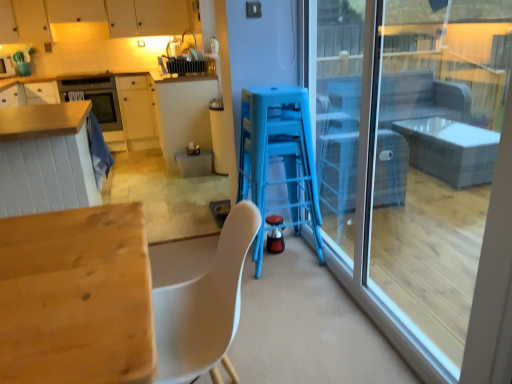
You are a GUI agent. You are given a task and a screenshot of the screen. Output one action in this format:
    pyautogui.click(x=<x>, y=<y>)
    Task: Click on the blue plastic bar stool at center
    The image size is (512, 384).
    Given the screenshot: What is the action you would take?
    pyautogui.click(x=278, y=156)

Image resolution: width=512 pixels, height=384 pixels. Find the location of `matte white cabinets at upper left, which appears as the first cabinetry when viewed from the top`. matte white cabinets at upper left, which appears as the first cabinetry when viewed from the top is located at coordinates (94, 17).

What is the approximate width of shiny black kettle at center, the first appliance when ordered from front to back?

4.61 inches.

This screenshot has width=512, height=384. Identify the location of matte wood cabinetry at left, which is the second cabinetry in top-to-bottom order. (140, 112).

Locate an element on the screen. The image size is (512, 384). blue plastic bar stool at center is located at coordinates (278, 156).

Looking at this image, would you say translucent plastic trash bin at center, the first table in the back-to-front sequence, is a long distance from matte wood cabinetry at left, which is the second cabinetry in top-to-bottom order?

Yes.

Between translucent plastic trash bin at center, which is the 1th table from top to bottom, and matte wood cabinetry at left, which is the second cabinetry in top-to-bottom order, which one has less height?

translucent plastic trash bin at center, which is the 1th table from top to bottom.

Is translucent plastic trash bin at center, the first table in the back-to-front sequence, bigger or smaller than matte wood cabinetry at left, the 1th cabinetry from the bottom?

In the image, translucent plastic trash bin at center, the first table in the back-to-front sequence, appears to be larger than matte wood cabinetry at left, the 1th cabinetry from the bottom.

You are a GUI agent. You are given a task and a screenshot of the screen. Output one action in this format:
    pyautogui.click(x=<x>, y=<y>)
    Task: Click on the table on the right of translucent plastic trash bin at center, acting as the 2th table starting from the bottom
    This screenshot has width=512, height=384.
    Given the screenshot: What is the action you would take?
    pyautogui.click(x=76, y=297)

Is translucent plastic trash bin at center, acting as the 2th table starting from the bottom, surrounding wooden table at lower left, placed as the second table when sorted from top to bottom?

No, wooden table at lower left, placed as the second table when sorted from top to bottom, is located outside of translucent plastic trash bin at center, acting as the 2th table starting from the bottom.

From the image's perspective, would you say translucent plastic trash bin at center, which is the 1th table from top to bottom, is positioned over wooden table at lower left, placed as the 1th table when sorted from bottom to top?

Yes, from the image's perspective, translucent plastic trash bin at center, which is the 1th table from top to bottom, is above wooden table at lower left, placed as the 1th table when sorted from bottom to top.

Which is in front, translucent plastic trash bin at center, the second table from the front, or wooden table at lower left, the 1th table viewed from the front?

wooden table at lower left, the 1th table viewed from the front, is in front.

Can you see matte black oven at upper left touching shiny black kettle at center, the 2th appliance viewed from the left?

There is a gap between matte black oven at upper left and shiny black kettle at center, the 2th appliance viewed from the left.

Which is more to the right, matte black oven at upper left or shiny black kettle at center, the 1th appliance when ordered from right to left?

Positioned to the right is shiny black kettle at center, the 1th appliance when ordered from right to left.

Which is in front, matte black oven at upper left or shiny black kettle at center, the 1th appliance when ordered from right to left?

shiny black kettle at center, the 1th appliance when ordered from right to left, is closer to the camera.

Which of these two, matte black oven at upper left or shiny black kettle at center, the first appliance when ordered from front to back, is smaller?

shiny black kettle at center, the first appliance when ordered from front to back.

Could you tell me if wooden table at lower left, placed as the second table when sorted from back to front, is turned towards matte white cabinets at upper left, which ranks as the second cabinetry in bottom-to-top order?

No, wooden table at lower left, placed as the second table when sorted from back to front, is not turned towards matte white cabinets at upper left, which ranks as the second cabinetry in bottom-to-top order.

Choose the correct answer: Is wooden table at lower left, placed as the 1th table when sorted from bottom to top, inside matte white cabinets at upper left, which ranks as the second cabinetry in bottom-to-top order, or outside it?

wooden table at lower left, placed as the 1th table when sorted from bottom to top, cannot be found inside matte white cabinets at upper left, which ranks as the second cabinetry in bottom-to-top order.

Does point (103, 117) come in front of point (26, 2)?

No, it is not.

Does matte black oven at upper left have a smaller size compared to matte white cabinets at upper left, which appears as the first cabinetry when viewed from the top?

Yes, matte black oven at upper left is smaller than matte white cabinets at upper left, which appears as the first cabinetry when viewed from the top.

Does matte black oven at upper left lie behind matte white cabinets at upper left, which appears as the first cabinetry when viewed from the top?

Yes, matte black oven at upper left is behind matte white cabinets at upper left, which appears as the first cabinetry when viewed from the top.

Looking at this image, measure the distance between transparent glass door at right and matte black oven at upper left.

4.15 meters.

From a real-world perspective, is transparent glass door at right on matte black oven at upper left?

Yes, from a real-world perspective, transparent glass door at right is on top of matte black oven at upper left.

Image resolution: width=512 pixels, height=384 pixels. I want to click on oven behind the transparent glass door at right, so click(x=96, y=98).

Between point (365, 158) and point (105, 91), which one is positioned behind?

The point (105, 91) is farther.

Could you measure the distance between matte wood cabinetry at left, which is the second cabinetry in top-to-bottom order, and translucent plastic trash bin at center, which is the 1th table from top to bottom?

matte wood cabinetry at left, which is the second cabinetry in top-to-bottom order, and translucent plastic trash bin at center, which is the 1th table from top to bottom, are 1.15 meters apart.

Does matte wood cabinetry at left, the 1th cabinetry from the bottom, appear on the right side of translucent plastic trash bin at center, which is the 1th table from top to bottom?

Incorrect, matte wood cabinetry at left, the 1th cabinetry from the bottom, is not on the right side of translucent plastic trash bin at center, which is the 1th table from top to bottom.

Considering the relative sizes of matte wood cabinetry at left, which is the second cabinetry in top-to-bottom order, and translucent plastic trash bin at center, acting as the 2th table starting from the bottom, in the image provided, is matte wood cabinetry at left, which is the second cabinetry in top-to-bottom order, smaller than translucent plastic trash bin at center, acting as the 2th table starting from the bottom,?

Yes, matte wood cabinetry at left, which is the second cabinetry in top-to-bottom order, is smaller than translucent plastic trash bin at center, acting as the 2th table starting from the bottom.

Are matte wood cabinetry at left, the 1th cabinetry from the bottom, and translucent plastic trash bin at center, the first table in the back-to-front sequence, located far from each other?

That's right, there is a large distance between matte wood cabinetry at left, the 1th cabinetry from the bottom, and translucent plastic trash bin at center, the first table in the back-to-front sequence.

Where is `the 1st table in front of the matte wood cabinetry at left, the 1th cabinetry from the bottom`? the 1st table in front of the matte wood cabinetry at left, the 1th cabinetry from the bottom is located at coordinates (183, 114).

Locate an element on the screen. table that is above the wooden table at lower left, the 1th table viewed from the front (from a real-world perspective) is located at coordinates (183, 114).

Which object lies nearer to the anchor point blue plastic bar stool at center, wooden table at lower left, placed as the second table when sorted from back to front, or matte wood cabinetry at left, the 1th cabinetry from the bottom?

wooden table at lower left, placed as the second table when sorted from back to front.

Considering their positions, is matte black oven at upper left positioned further to matte white cabinets at upper left, which appears as the first cabinetry when viewed from the top, than shiny black kettle at center, the 2th appliance viewed from the left?

Among the two, shiny black kettle at center, the 2th appliance viewed from the left, is located further to matte white cabinets at upper left, which appears as the first cabinetry when viewed from the top.

Considering their positions, is shiny black kettle at center, the 2th appliance viewed from the left, positioned further to matte wood cabinetry at left, the 1th cabinetry from the bottom, than matte white toaster at upper left, the first appliance viewed from the back?

The object further to matte wood cabinetry at left, the 1th cabinetry from the bottom, is shiny black kettle at center, the 2th appliance viewed from the left.

Which object lies further to the anchor point wooden table at lower left, the 1th table viewed from the front, transparent glass door at right or matte wood cabinetry at left, which is the second cabinetry in top-to-bottom order?

matte wood cabinetry at left, which is the second cabinetry in top-to-bottom order.

Based on their spatial positions, is wooden table at lower left, placed as the second table when sorted from back to front, or matte white cabinets at upper left, which appears as the first cabinetry when viewed from the top, further from matte black oven at upper left?

wooden table at lower left, placed as the second table when sorted from back to front.

Based on their spatial positions, is matte wood cabinetry at left, which is the second cabinetry in top-to-bottom order, or matte white toaster at upper left, the first appliance positioned from the top, further from matte white cabinets at upper left, which appears as the first cabinetry when viewed from the top?

matte white toaster at upper left, the first appliance positioned from the top, lies further to matte white cabinets at upper left, which appears as the first cabinetry when viewed from the top, than the other object.

Which object lies further to the anchor point shiny black kettle at center, the first appliance when ordered from front to back, matte white cabinets at upper left, which appears as the first cabinetry when viewed from the top, or translucent plastic trash bin at center, acting as the 2th table starting from the bottom?

Based on the image, matte white cabinets at upper left, which appears as the first cabinetry when viewed from the top, appears to be further to shiny black kettle at center, the first appliance when ordered from front to back.

Considering their positions, is matte white toaster at upper left, which appears as the 2th appliance when viewed from the front, positioned further to blue plastic bar stool at center than shiny black kettle at center, the first appliance in the bottom-to-top sequence?

matte white toaster at upper left, which appears as the 2th appliance when viewed from the front, lies further to blue plastic bar stool at center than the other object.

This screenshot has width=512, height=384. What are the coordinates of `cabinetry between wooden table at lower left, placed as the 1th table when sorted from bottom to top, and matte white cabinets at upper left, which appears as the first cabinetry when viewed from the top, from front to back` in the screenshot? It's located at (140, 112).

Find the location of a particular element. This screenshot has height=384, width=512. bar stool positioned between wooden table at lower left, placed as the second table when sorted from back to front, and shiny black kettle at center, acting as the 2th appliance starting from the back, from near to far is located at coordinates (278, 156).

Where is `bar stool between wooden table at lower left, placed as the second table when sorted from back to front, and matte white cabinets at upper left, which appears as the first cabinetry when viewed from the top, in the front-back direction`? This screenshot has height=384, width=512. bar stool between wooden table at lower left, placed as the second table when sorted from back to front, and matte white cabinets at upper left, which appears as the first cabinetry when viewed from the top, in the front-back direction is located at coordinates (278, 156).

Where is `bar stool positioned between transparent glass door at right and translucent plastic trash bin at center, acting as the 2th table starting from the bottom, from near to far`? This screenshot has width=512, height=384. bar stool positioned between transparent glass door at right and translucent plastic trash bin at center, acting as the 2th table starting from the bottom, from near to far is located at coordinates (278, 156).